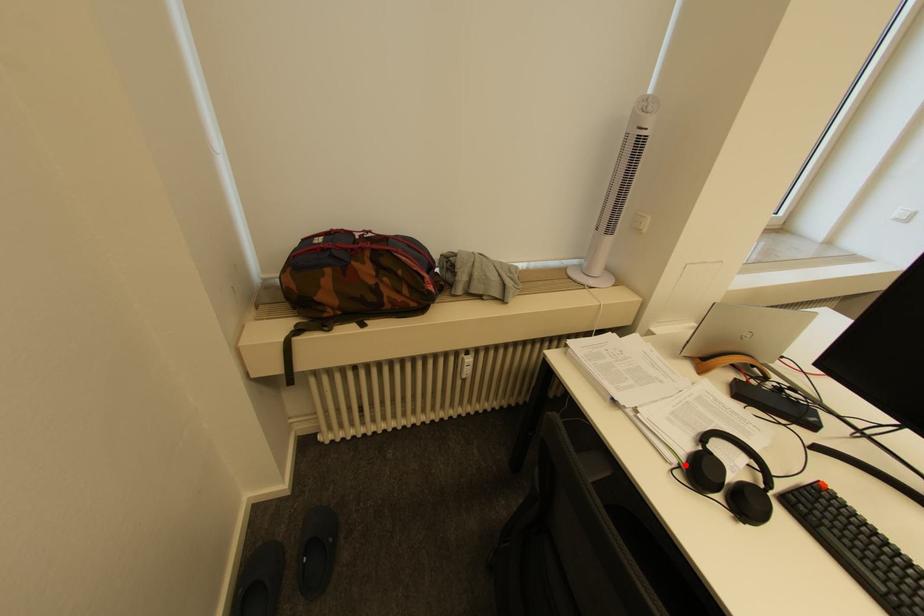
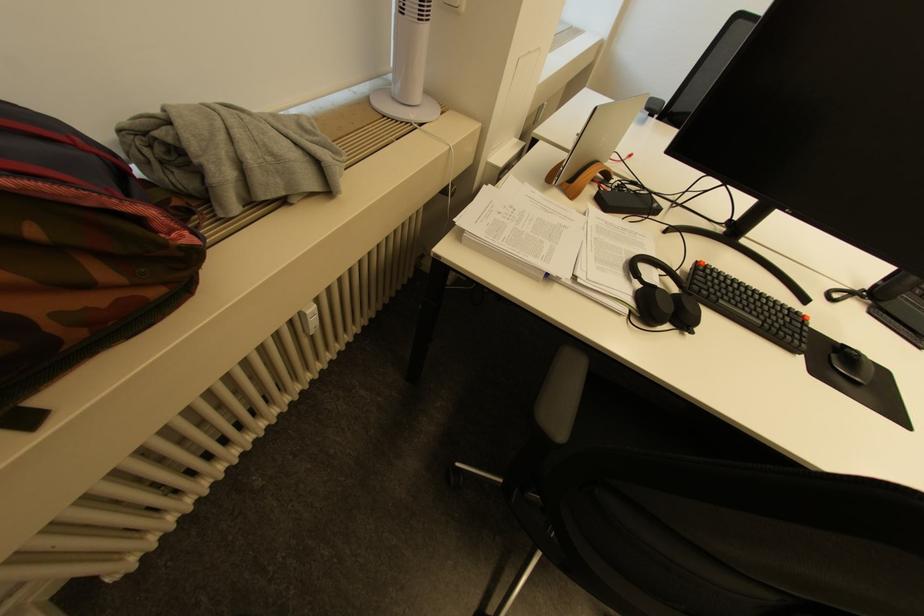
Locate, in the second image, the point that corresponds to the highlighted location in the first image.

(637, 312)